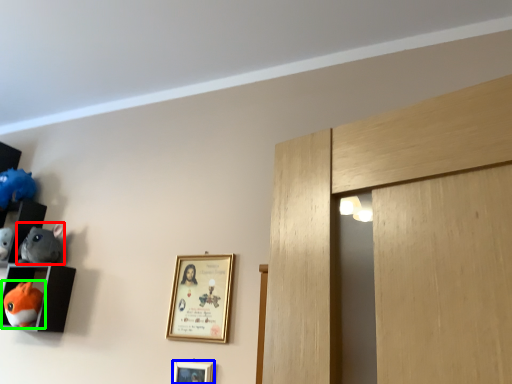
Question: Which object is positioned closest to toy (highlighted by a red box)? Select from picture frame (highlighted by a blue box) and toy (highlighted by a green box).

Choices:
 (A) picture frame
 (B) toy

Answer: (B)